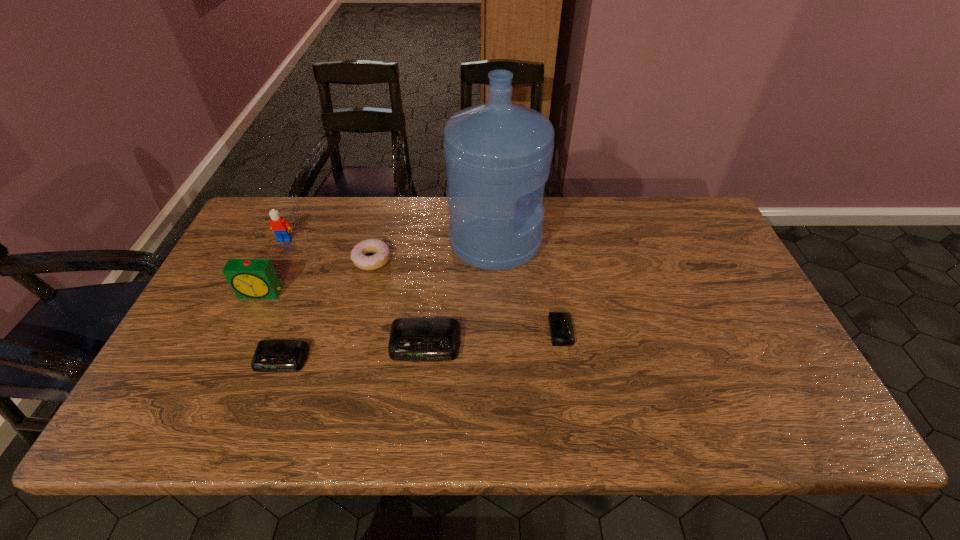
Identify the location of the sixth tallest object. Image resolution: width=960 pixels, height=540 pixels. (270, 355).

Locate an element on the screen. The width and height of the screenshot is (960, 540). the second shortest alarm clock is located at coordinates (270, 355).

I want to click on the third alarm clock from left to right, so click(x=411, y=339).

The width and height of the screenshot is (960, 540). Find the location of `the rightmost alarm clock`. the rightmost alarm clock is located at coordinates (561, 328).

Find the location of `the shortest alarm clock`. the shortest alarm clock is located at coordinates (561, 328).

You are a GUI agent. You are given a task and a screenshot of the screen. Output one action in this format:
    pyautogui.click(x=<x>, y=<y>)
    Task: Click on the tallest object
    This screenshot has height=540, width=960.
    Given the screenshot: What is the action you would take?
    pyautogui.click(x=498, y=154)

I want to click on Lego, so click(281, 227).

At what (x,y) coordinates should I click in order to perform the action: click on the tallest alarm clock. Please return your answer as a coordinate pair (x, y). The width and height of the screenshot is (960, 540). Looking at the image, I should click on (249, 278).

Find the location of a particular element. The image size is (960, 540). the leftmost alarm clock is located at coordinates (249, 278).

In order to click on doughnut in this screenshot , I will do `click(382, 250)`.